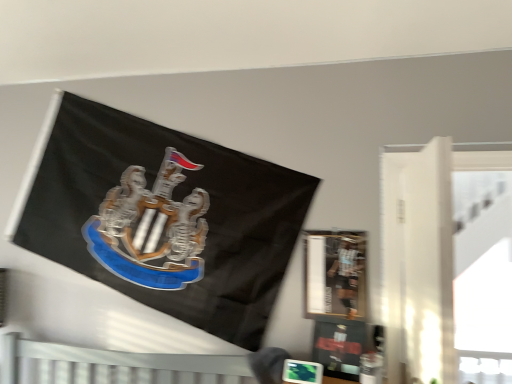
Question: Is metallic silver frame at upper right positioned with its back to white sheer curtain at right?

Choices:
 (A) yes
 (B) no

Answer: (B)

Question: Is metallic silver frame at upper right smaller than white sheer curtain at right?

Choices:
 (A) yes
 (B) no

Answer: (A)

Question: Is white sheer curtain at right surrounded by metallic silver frame at upper right?

Choices:
 (A) yes
 (B) no

Answer: (B)

Question: Are metallic silver frame at upper right and white sheer curtain at right making contact?

Choices:
 (A) no
 (B) yes

Answer: (A)

Question: From the image's perspective, is metallic silver frame at upper right below white sheer curtain at right?

Choices:
 (A) yes
 (B) no

Answer: (A)

Question: Are metallic silver frame at upper right and white sheer curtain at right far apart?

Choices:
 (A) yes
 (B) no

Answer: (B)

Question: Does white sheer curtain at right contain metallic silver frame at upper right?

Choices:
 (A) yes
 (B) no

Answer: (B)

Question: Is the surface of white sheer curtain at right in direct contact with metallic silver frame at upper right?

Choices:
 (A) yes
 (B) no

Answer: (B)

Question: Could you tell me if white sheer curtain at right is turned towards metallic silver frame at upper right?

Choices:
 (A) yes
 (B) no

Answer: (B)

Question: Is white sheer curtain at right not inside metallic silver frame at upper right?

Choices:
 (A) no
 (B) yes

Answer: (B)

Question: Is the depth of white sheer curtain at right greater than that of metallic silver frame at upper right?

Choices:
 (A) no
 (B) yes

Answer: (A)

Question: Is metallic silver frame at upper right at the back of white sheer curtain at right?

Choices:
 (A) no
 (B) yes

Answer: (A)

Question: From the image's perspective, is metallic silver frame at upper right positioned above or below white sheer curtain at right?

Choices:
 (A) above
 (B) below

Answer: (B)